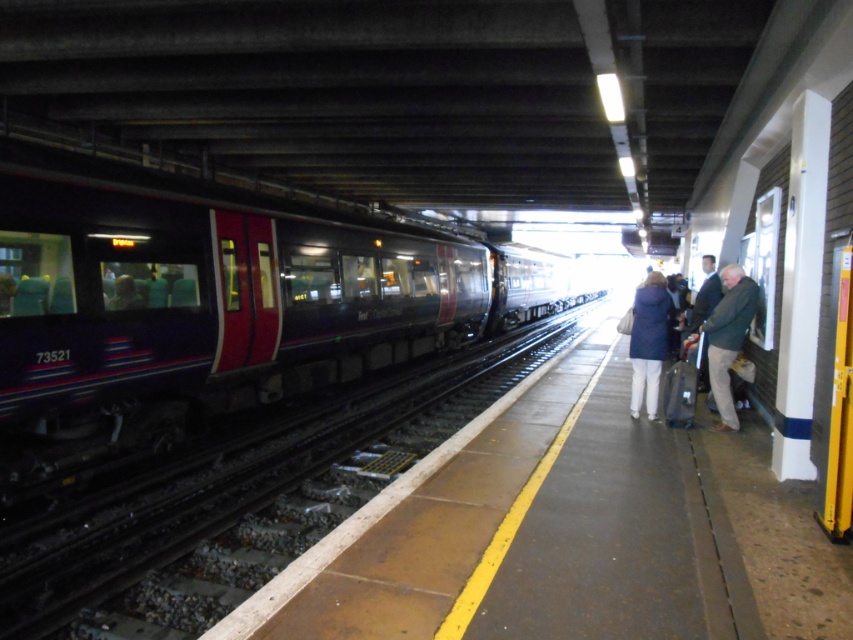
You are a photographer standing on the platform and want to take a photo of the two people wearing the dark blue jacket at right and matte blue coat at right. Since you want to capture both clearly in the frame, which clothing item should you focus on first to ensure proper focus, considering their sizes?

The dark blue jacket at right has a smaller size compared to the matte blue coat at right. Therefore, you should focus on the matte blue coat at right first because it is larger and will be easier to capture clearly in the frame.

You are a passenger standing on the platform and want to know if the metallic blue train at center is taller than the dark blue jacket at right. Can you determine this based on your observation?

The metallic blue train at center is taller than the dark blue jacket at right.